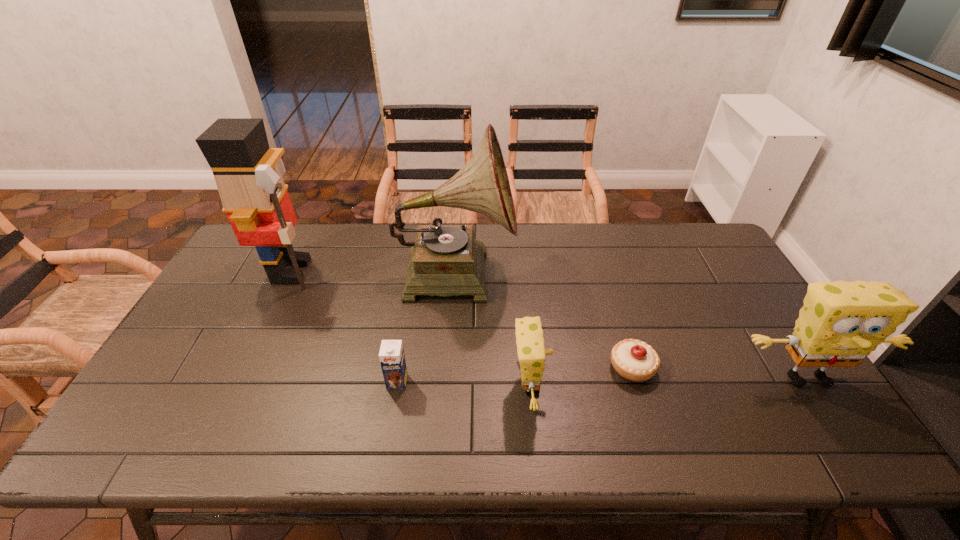
Locate an element on the screen. the left sponge is located at coordinates (531, 352).

Locate an element on the screen. The height and width of the screenshot is (540, 960). the shorter sponge is located at coordinates (531, 352).

At what (x,y) coordinates should I click in order to perform the action: click on the right sponge. Please return your answer as a coordinate pair (x, y). The image size is (960, 540). Looking at the image, I should click on (841, 323).

The image size is (960, 540). In order to click on the third tallest object in this screenshot , I will do `click(841, 323)`.

The image size is (960, 540). Find the location of `record player`. record player is located at coordinates (445, 260).

I want to click on the leftmost object, so click(255, 198).

Locate an element on the screen. the second shortest object is located at coordinates [391, 355].

At what (x,y) coordinates should I click in order to perform the action: click on the shortest object. Please return your answer as a coordinate pair (x, y). The height and width of the screenshot is (540, 960). Looking at the image, I should click on (634, 360).

Where is `pastry`? The width and height of the screenshot is (960, 540). pastry is located at coordinates (634, 360).

I want to click on free region located 0.340m on the face of the left sponge, so click(684, 386).